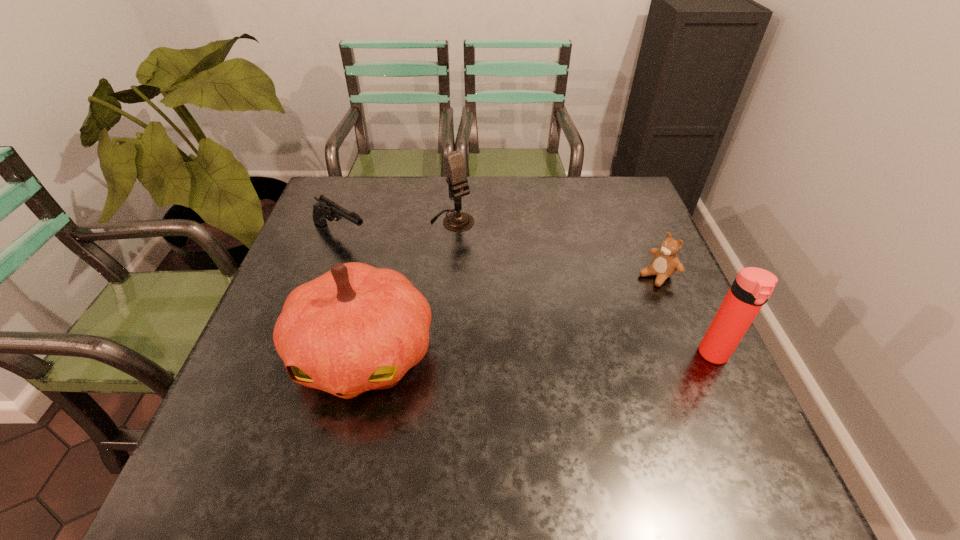
What are the coordinates of `vacant space located on the front-facing side of the microphone` in the screenshot? It's located at (510, 274).

You are a GUI agent. You are given a task and a screenshot of the screen. Output one action in this format:
    pyautogui.click(x=<x>, y=<y>)
    Task: Click on the free location located 0.300m on the front-facing side of the microphone
    The image size is (960, 540).
    Given the screenshot: What is the action you would take?
    pyautogui.click(x=529, y=293)

The height and width of the screenshot is (540, 960). I want to click on vacant region located 0.220m at the end of the barrel of the gun, so click(421, 279).

You are a GUI agent. You are given a task and a screenshot of the screen. Output one action in this format:
    pyautogui.click(x=<x>, y=<y>)
    Task: Click on the free region located at the end of the barrel of the gun
    
    Given the screenshot: What is the action you would take?
    pyautogui.click(x=375, y=252)

The image size is (960, 540). I want to click on free space located 0.390m at the end of the barrel of the gun, so click(x=473, y=310).

You are a GUI agent. You are given a task and a screenshot of the screen. Output one action in this format:
    pyautogui.click(x=<x>, y=<y>)
    Task: Click on the microphone that is at the far edge
    This screenshot has width=960, height=540.
    Given the screenshot: What is the action you would take?
    pyautogui.click(x=455, y=169)

You are a GUI agent. You are given a task and a screenshot of the screen. Output one action in this format:
    pyautogui.click(x=<x>, y=<y>)
    Task: Click on the gun positioned at the far edge
    The width and height of the screenshot is (960, 540).
    Given the screenshot: What is the action you would take?
    pyautogui.click(x=325, y=209)

I want to click on object that is at the near edge, so click(356, 328).

At what (x,y) coordinates should I click in order to perform the action: click on pumpkin that is at the left edge. Please return your answer as a coordinate pair (x, y). This screenshot has width=960, height=540. Looking at the image, I should click on (356, 328).

Where is `gun located at the left edge`? This screenshot has width=960, height=540. gun located at the left edge is located at coordinates (325, 209).